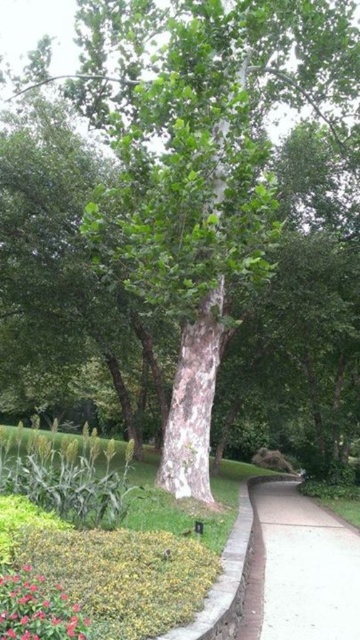
Can you confirm if white concrete sidewalk at lower right is positioned above vivid pink petals at lower left?

Incorrect, white concrete sidewalk at lower right is not positioned above vivid pink petals at lower left.

Which is behind, point (321, 588) or point (29, 627)?

The point (321, 588) is behind.

The height and width of the screenshot is (640, 360). I want to click on white concrete sidewalk at lower right, so [306, 566].